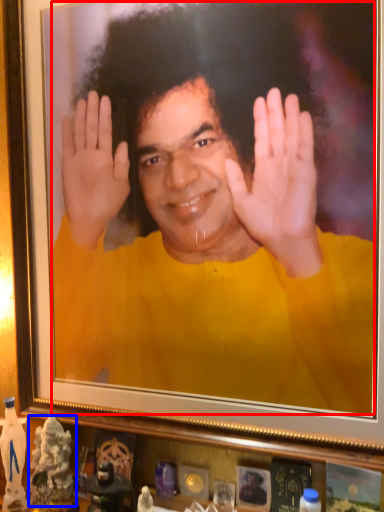
Question: Which of the following is the closest to the observer, man (highlighted by a red box) or toy (highlighted by a blue box)?

Choices:
 (A) man
 (B) toy

Answer: (A)